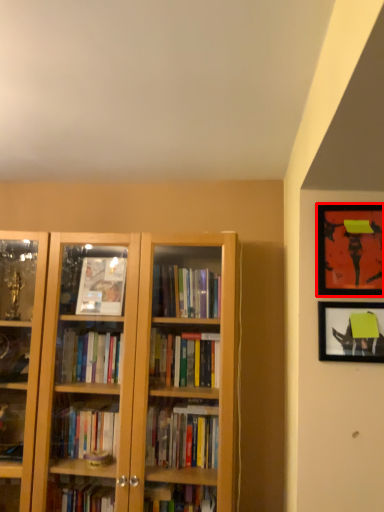
Question: From the image's perspective, considering the relative positions of picture frame (annotated by the red box) and picture frame in the image provided, where is picture frame (annotated by the red box) located with respect to the staircase?

Choices:
 (A) above
 (B) below

Answer: (A)